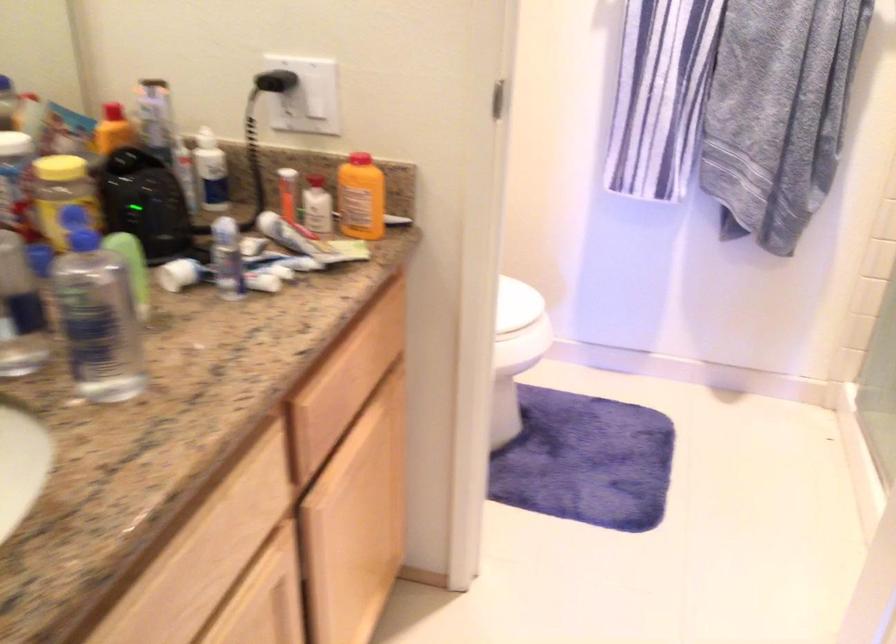
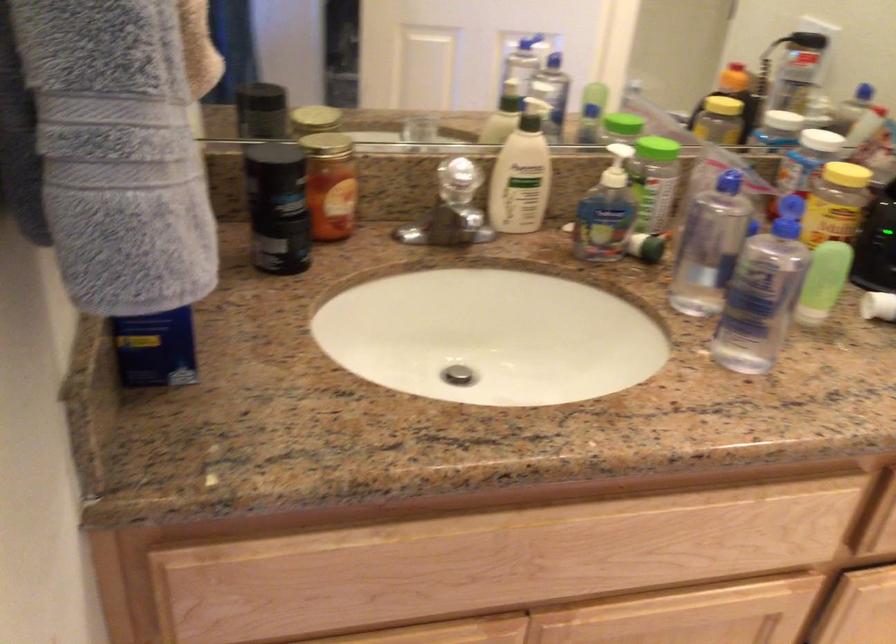
Question: The images are taken continuously from a first-person perspective. In which direction is your viewpoint rotating?

Choices:
 (A) Left
 (B) Right
 (C) Up
 (D) Down

Answer: (A)